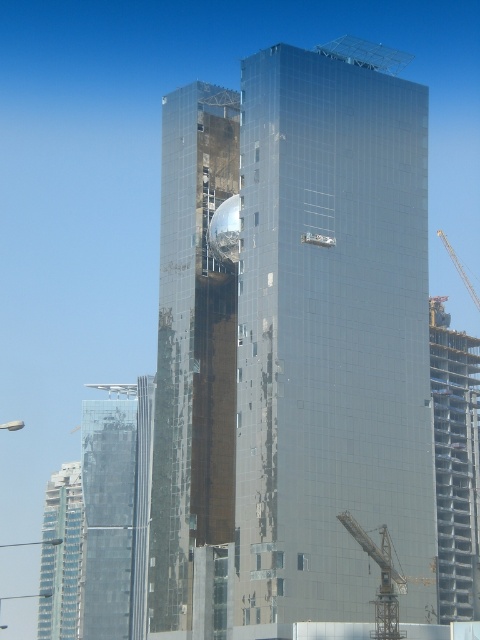
Question: Does shiny glass tower at center have a larger size compared to clear glass building at lower left?

Choices:
 (A) yes
 (B) no

Answer: (A)

Question: Does transparent glass tower at center have a greater width compared to metallic glass building at right?

Choices:
 (A) yes
 (B) no

Answer: (B)

Question: Which point is farther to the camera?

Choices:
 (A) (166, 320)
 (B) (130, 580)
 (C) (253, 266)
 (D) (48, 602)

Answer: (D)

Question: Which of the following is the closest to the observer?

Choices:
 (A) (283, 339)
 (B) (72, 630)

Answer: (A)

Question: Which is nearer to the glossy glass building at center?

Choices:
 (A) shiny glass tower at center
 (B) clear glass building at lower left
 (C) transparent glass tower at center

Answer: (A)

Question: Does shiny glass tower at center appear on the right side of metallic glass building at right?

Choices:
 (A) yes
 (B) no

Answer: (B)